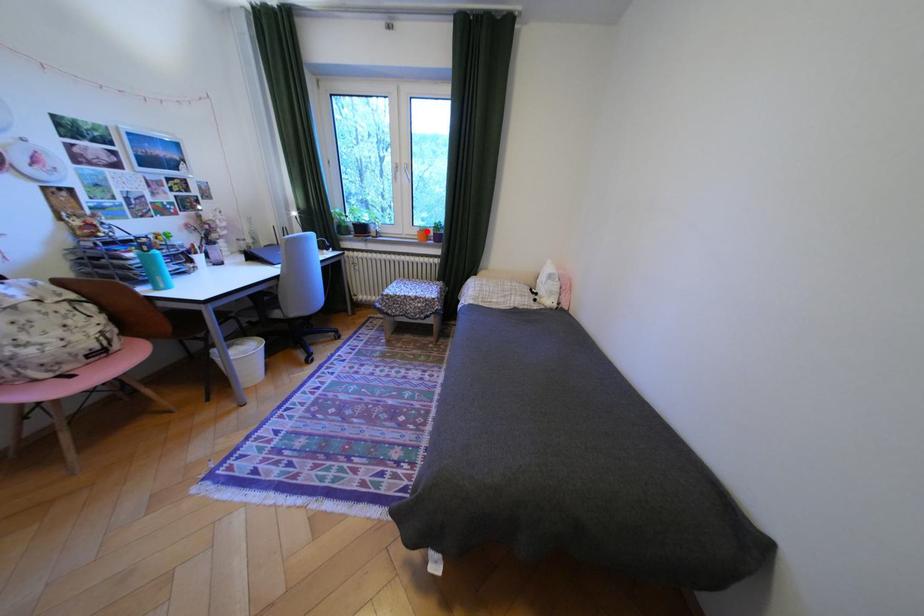
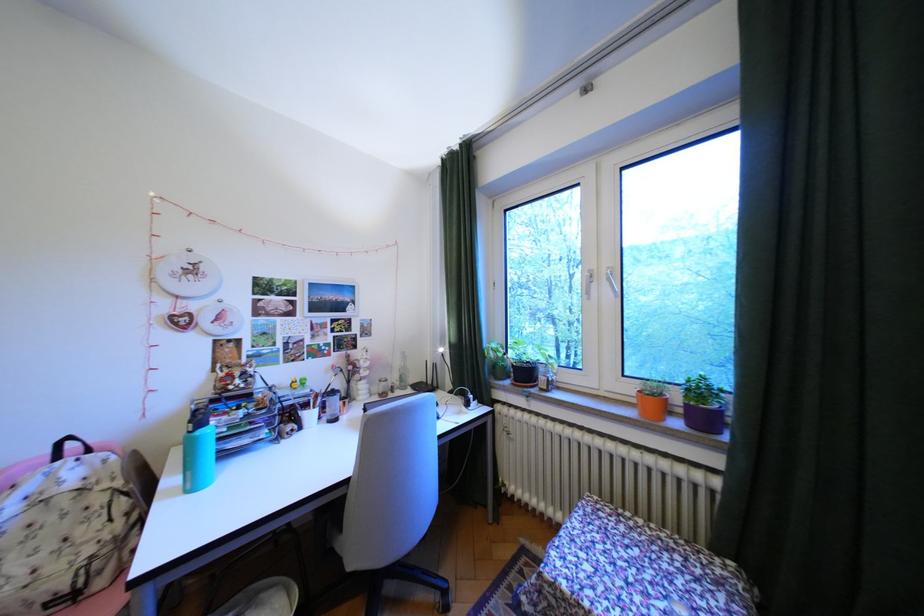
In the second image, find the point that corresponds to the highlighted location in the first image.

(641, 390)